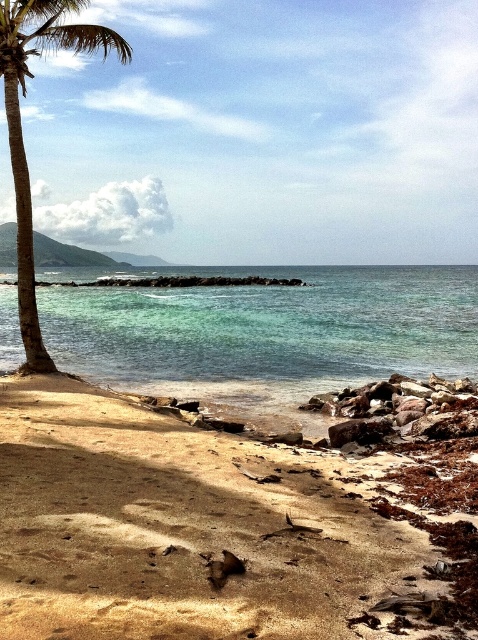
Question: From the image, what is the correct spatial relationship of brown sandy beach at lower left in relation to rusty metallic rocks at lower right?

Choices:
 (A) right
 (B) left

Answer: (B)

Question: Which is nearer to the green leafy palm tree at left?

Choices:
 (A) rusty metallic rocks at lower right
 (B) clear blue water at center
 (C) brown sandy beach at lower left

Answer: (C)

Question: Among these objects, which one is farthest from the camera?

Choices:
 (A) rusty metallic rocks at lower right
 (B) green leafy palm tree at left

Answer: (B)

Question: Can you confirm if clear blue water at center is positioned to the left of green leafy palm tree at left?

Choices:
 (A) yes
 (B) no

Answer: (B)

Question: Which point is closer to the camera taking this photo?

Choices:
 (A) (321, 266)
 (B) (42, 346)

Answer: (B)

Question: Can you confirm if brown sandy beach at lower left is thinner than rusty metallic rocks at lower right?

Choices:
 (A) no
 (B) yes

Answer: (A)